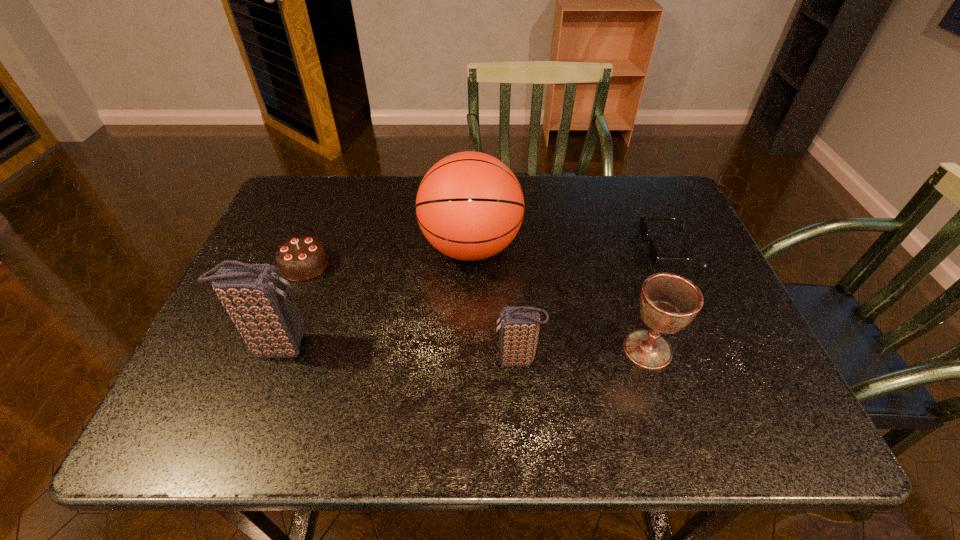
Image resolution: width=960 pixels, height=540 pixels. Find the location of `blank region between the rightmost object and the shorter clutch bag`. blank region between the rightmost object and the shorter clutch bag is located at coordinates (594, 305).

Where is `vacant area between the basketball and the right clutch bag`? vacant area between the basketball and the right clutch bag is located at coordinates (494, 303).

The height and width of the screenshot is (540, 960). Identify the location of unoccupied position between the fifth object from left to right and the basketball. (560, 298).

Find the location of a particular element. free space between the basketball and the sunglasses is located at coordinates (571, 248).

Locate an element on the screen. unoccupied position between the right clutch bag and the basketball is located at coordinates (494, 303).

Locate an element on the screen. Image resolution: width=960 pixels, height=540 pixels. vacant space that's between the shorter clutch bag and the left clutch bag is located at coordinates (397, 353).

Where is `free space between the second object from right to left and the basketball`? free space between the second object from right to left and the basketball is located at coordinates (560, 298).

Identify the location of free space between the left clutch bag and the rightmost object. This screenshot has height=540, width=960. (474, 298).

This screenshot has width=960, height=540. What are the coordinates of `the fourth closest object relative to the fifth object from left to right` in the screenshot? It's located at (256, 296).

Point out which object is positioned as the fifth nearest to the chocolate cake. Please provide its 2D coordinates. Your answer should be formatted as a tuple, i.e. [(x, y)], where the tuple contains the x and y coordinates of a point satisfying the conditions above.

[(652, 252)]